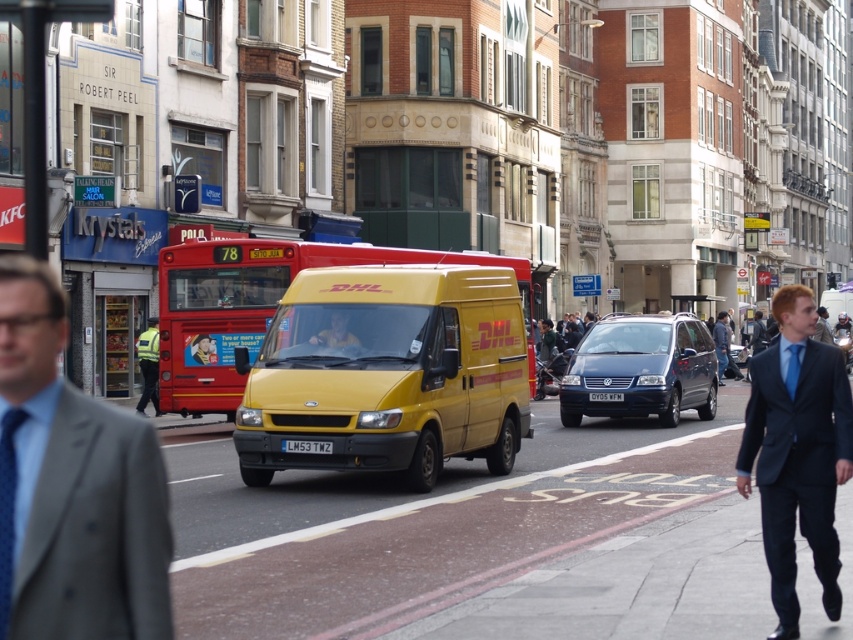
Question: Which point appears farthest from the camera in this image?

Choices:
 (A) (790, 385)
 (B) (788, 582)

Answer: (A)

Question: Can you confirm if matte yellow van at center is positioned above blue silk tie at right?

Choices:
 (A) no
 (B) yes

Answer: (B)

Question: Is gray suit at center above matte yellow van at center?

Choices:
 (A) yes
 (B) no

Answer: (B)

Question: Which object is positioned closest to the gray suit at center?

Choices:
 (A) yellow matte van at center
 (B) blue silk tie at right
 (C) denim jacket at center
 (D) blue silk tie at left

Answer: (D)

Question: Which point is farther from the camera taking this photo?

Choices:
 (A) (416, 458)
 (B) (347, 342)

Answer: (B)

Question: Is dark blue suit at right to the left of reflective yellow vest at left from the viewer's perspective?

Choices:
 (A) yes
 (B) no

Answer: (B)